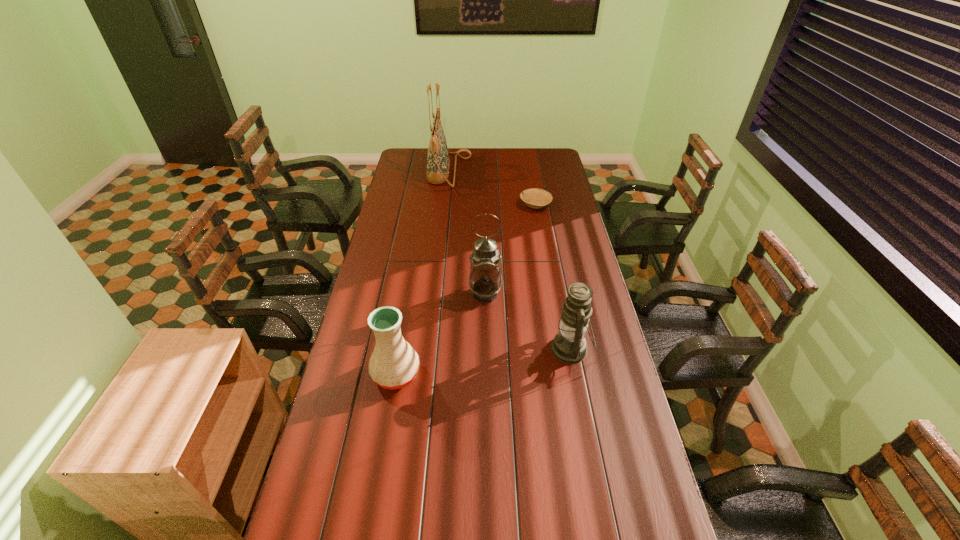
Identify the location of vacant space that satisfies the following two spatial constraints: 1. on the back side of the shortest object; 2. on the front-facing side of the handbag. (530, 171).